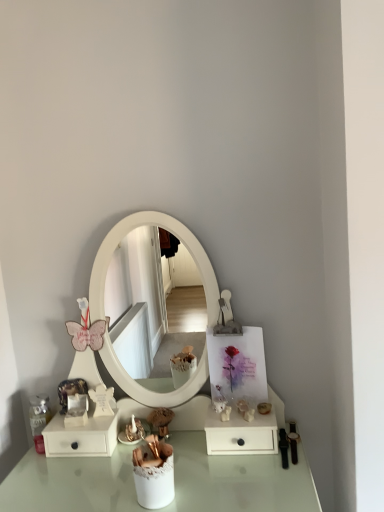
Question: Are white matte drawer at lower right, placed as the second dresser when sorted from left to right, and white matte drawer at lower left, positioned as the 1th dresser in left-to-right order, located far from each other?

Choices:
 (A) yes
 (B) no

Answer: (B)

Question: Is white matte drawer at lower right, which ranks as the 1th dresser in right-to-left order, closer to camera compared to white matte drawer at lower left, positioned as the 2th dresser in right-to-left order?

Choices:
 (A) no
 (B) yes

Answer: (B)

Question: Could white matte drawer at lower left, positioned as the 1th dresser in left-to-right order, be considered to be inside white matte drawer at lower right, placed as the second dresser when sorted from left to right?

Choices:
 (A) no
 (B) yes

Answer: (A)

Question: Can you confirm if white matte drawer at lower right, placed as the second dresser when sorted from left to right, is bigger than white matte drawer at lower left, positioned as the 1th dresser in left-to-right order?

Choices:
 (A) no
 (B) yes

Answer: (A)

Question: From a real-world perspective, is white matte drawer at lower right, which ranks as the 1th dresser in right-to-left order, positioned under white matte drawer at lower left, positioned as the 2th dresser in right-to-left order, based on gravity?

Choices:
 (A) no
 (B) yes

Answer: (B)

Question: Is white matte drawer at lower right, placed as the second dresser when sorted from left to right, thinner than white matte drawer at lower left, positioned as the 2th dresser in right-to-left order?

Choices:
 (A) no
 (B) yes

Answer: (A)

Question: Is white matte drawer at lower right, which ranks as the 1th dresser in right-to-left order, at the back of white matte drawer at lower left, positioned as the 2th dresser in right-to-left order?

Choices:
 (A) no
 (B) yes

Answer: (A)

Question: Does white matte drawer at lower left, positioned as the 2th dresser in right-to-left order, come behind white matte drawer at lower right, which ranks as the 1th dresser in right-to-left order?

Choices:
 (A) no
 (B) yes

Answer: (B)

Question: Considering the relative sizes of white matte drawer at lower left, positioned as the 1th dresser in left-to-right order, and white matte drawer at lower right, which ranks as the 1th dresser in right-to-left order, in the image provided, is white matte drawer at lower left, positioned as the 1th dresser in left-to-right order, taller than white matte drawer at lower right, which ranks as the 1th dresser in right-to-left order,?

Choices:
 (A) no
 (B) yes

Answer: (B)

Question: Does white matte drawer at lower left, positioned as the 1th dresser in left-to-right order, have a larger size compared to white matte drawer at lower right, which ranks as the 1th dresser in right-to-left order?

Choices:
 (A) no
 (B) yes

Answer: (B)

Question: From a real-world perspective, does white matte drawer at lower left, positioned as the 2th dresser in right-to-left order, sit lower than white matte drawer at lower right, which ranks as the 1th dresser in right-to-left order?

Choices:
 (A) yes
 (B) no

Answer: (B)

Question: Is white matte drawer at lower left, positioned as the 2th dresser in right-to-left order, facing towards white matte drawer at lower right, placed as the second dresser when sorted from left to right?

Choices:
 (A) no
 (B) yes

Answer: (A)

Question: Is matte gold figurine at lower center at the left side of white matte drawer at lower left, positioned as the 1th dresser in left-to-right order?

Choices:
 (A) no
 (B) yes

Answer: (A)